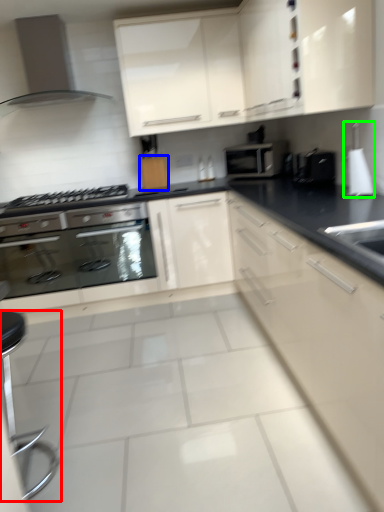
Question: Based on their relative distances, which object is nearer to bar stool (highlighted by a red box)? Choose from cabinetry (highlighted by a blue box) and appliance (highlighted by a green box).

Choices:
 (A) cabinetry
 (B) appliance

Answer: (A)